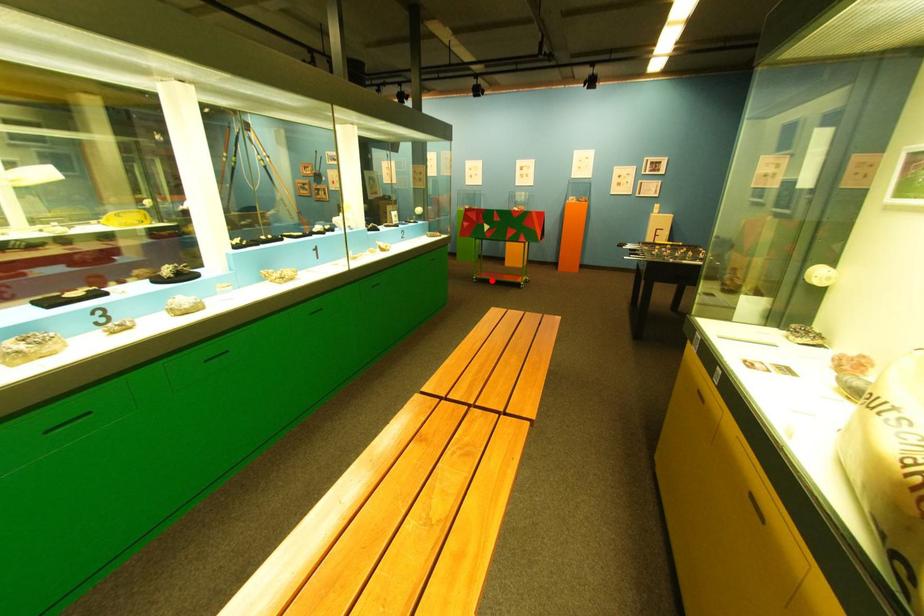
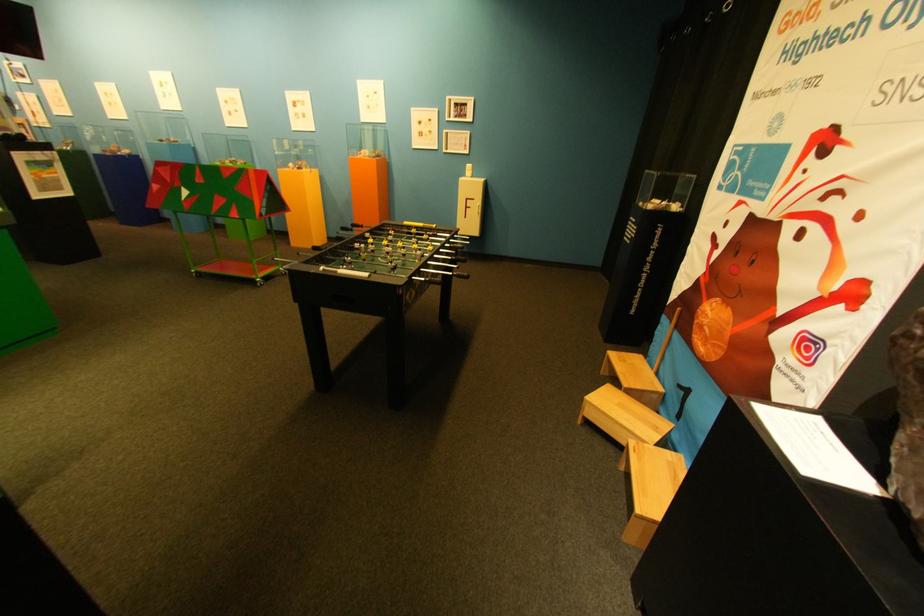
In the second image, find the point that corresponds to the highlighted location in the first image.

(213, 274)